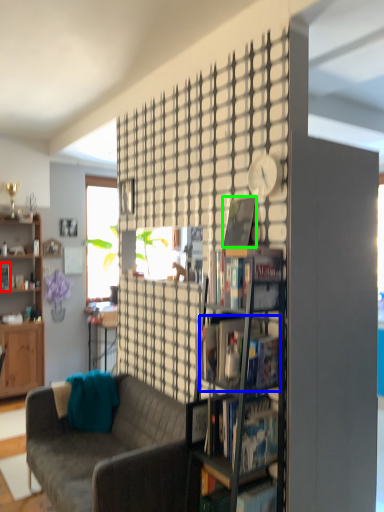
Question: Estimate the real-world distances between objects in this image. Which object is farther from book (highlighted by a red box), book (highlighted by a blue box) or book (highlighted by a green box)?

Choices:
 (A) book
 (B) book

Answer: (A)